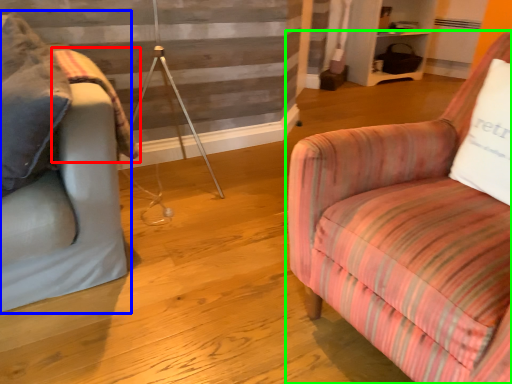
Question: Considering the real-world distances, which object is farthest from blanket (highlighted by a red box)? studio couch (highlighted by a blue box) or chair (highlighted by a green box)?

Choices:
 (A) studio couch
 (B) chair

Answer: (B)